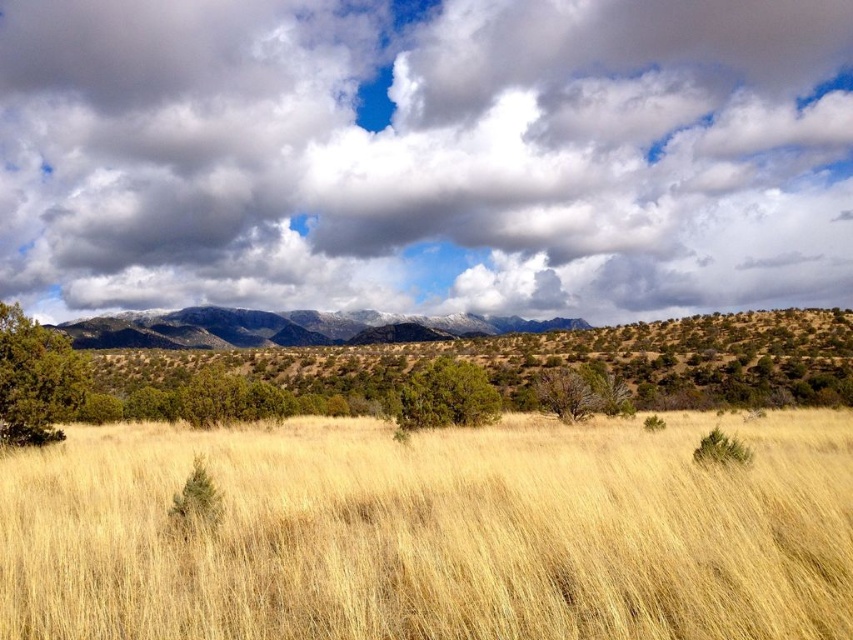
Question: Estimate the real-world distances between objects in this image. Which object is farther from the green matte bush at center?

Choices:
 (A) green shrub at center
 (B) dry grass at lower center
 (C) green textured bush at left

Answer: (A)

Question: Is green shrub at center wider than snow-covered rock at upper center?

Choices:
 (A) yes
 (B) no

Answer: (B)

Question: Is cloudy sky at upper center closer to the viewer compared to snow-covered rock at upper center?

Choices:
 (A) yes
 (B) no

Answer: (B)

Question: Among these objects, which one is farthest from the camera?

Choices:
 (A) cloudy sky at upper center
 (B) dry grass at lower center
 (C) green matte bush at center

Answer: (A)

Question: Can you confirm if cloudy sky at upper center is positioned above green shrub at center?

Choices:
 (A) yes
 (B) no

Answer: (A)

Question: Estimate the real-world distances between objects in this image. Which object is closer to the cloudy sky at upper center?

Choices:
 (A) dry grass at lower center
 (B) green matte bush at center
 (C) green shrub at center

Answer: (C)